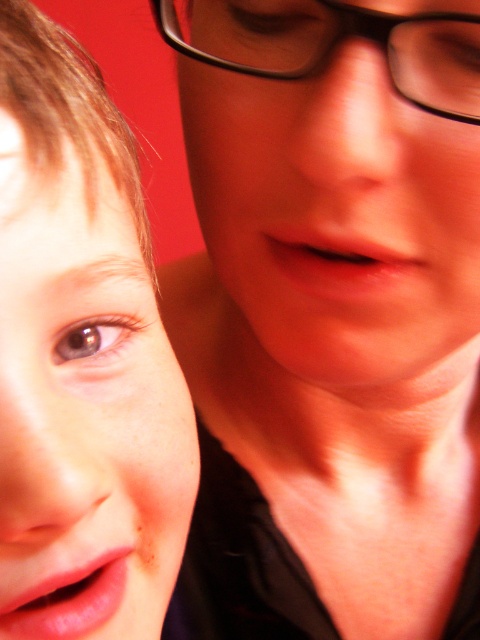
You are a GUI agent. You are given a task and a screenshot of the screen. Output one action in this format:
    pyautogui.click(x=<x>, y=<y>)
    Task: Click on the smooth skin face at left
    
    Given the screenshot: What is the action you would take?
    pyautogui.click(x=81, y=358)

Is smooth skin face at left to the left of black plastic glasses at upper center from the viewer's perspective?

Indeed, smooth skin face at left is positioned on the left side of black plastic glasses at upper center.

Does point (6, 388) come closer to viewer compared to point (458, 76)?

Yes, it is in front of point (458, 76).

Identify the location of smooth skin face at left. This screenshot has width=480, height=640. (81, 358).